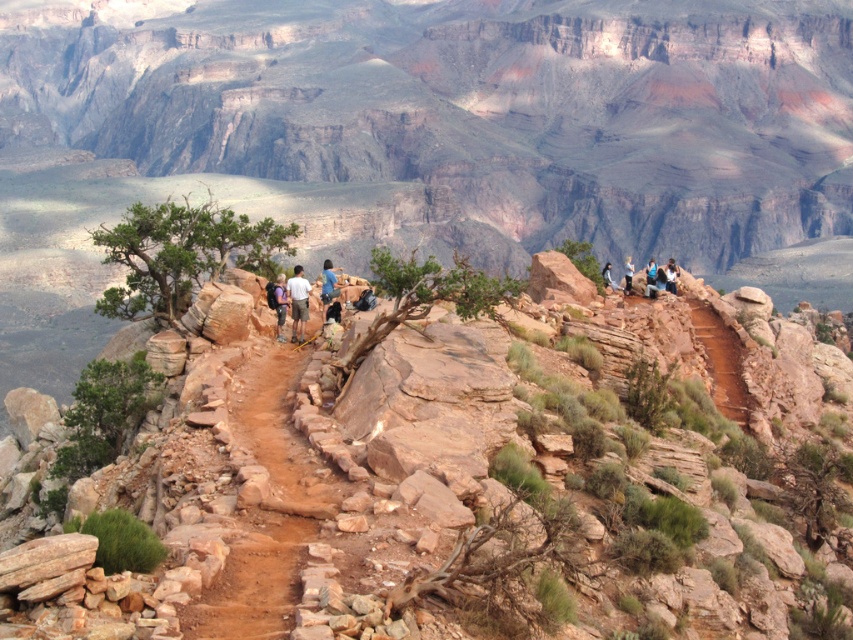
Between point (325, 268) and point (665, 273), which one is positioned behind?

Positioned behind is point (665, 273).

Does point (335, 285) come in front of point (672, 275)?

Yes.

The width and height of the screenshot is (853, 640). Find the location of `blue fabric backpack at center`. blue fabric backpack at center is located at coordinates (329, 289).

Is brown rocky trail at center in front of camouflage fabric backpack at center?

Yes, it is in front of camouflage fabric backpack at center.

Who is shorter, brown rocky trail at center or camouflage fabric backpack at center?

camouflage fabric backpack at center

This screenshot has height=640, width=853. What do you see at coordinates (254, 582) in the screenshot? I see `brown rocky trail at center` at bounding box center [254, 582].

I want to click on brown rocky trail at center, so click(254, 582).

Between brown dirt stairs at center and light blue denim jeans at upper right, which one appears on the right side from the viewer's perspective?

From the viewer's perspective, light blue denim jeans at upper right appears more on the right side.

Which is behind, point (727, 340) or point (625, 273)?

Positioned behind is point (625, 273).

Between point (724, 333) and point (625, 276), which one is positioned behind?

The point (625, 276) is more distant.

Image resolution: width=853 pixels, height=640 pixels. Identify the location of brown dirt stairs at center. (721, 360).